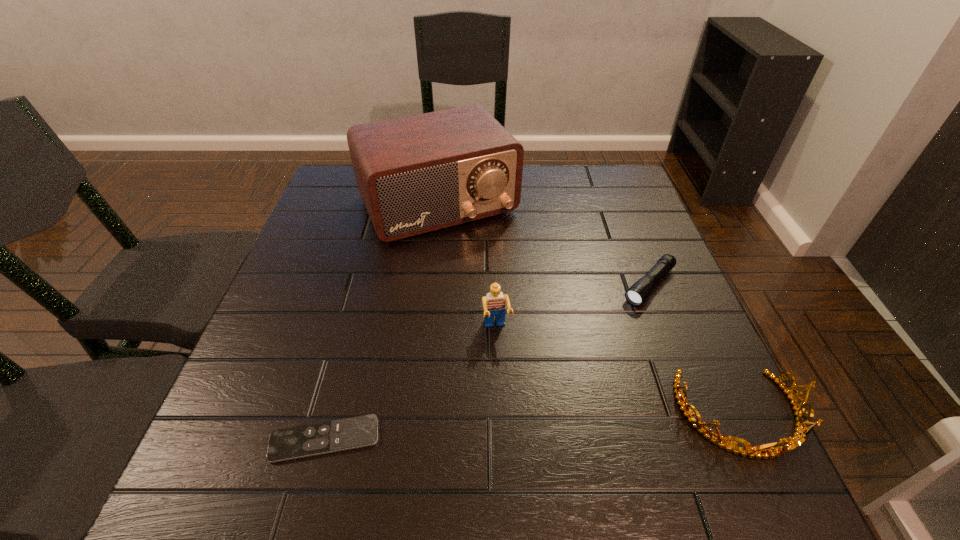
This screenshot has width=960, height=540. What are the coordinates of `the shortest object` in the screenshot? It's located at (285, 444).

This screenshot has height=540, width=960. In order to click on tiara in this screenshot , I will do `click(799, 437)`.

Identify the location of flashlight. (641, 289).

The height and width of the screenshot is (540, 960). What are the coordinates of `the fourth nearest object` in the screenshot? It's located at (641, 289).

What are the coordinates of `the tallest object` in the screenshot? It's located at (416, 174).

Locate an element on the screen. The height and width of the screenshot is (540, 960). the farthest object is located at coordinates (416, 174).

I want to click on the third nearest object, so click(493, 303).

This screenshot has width=960, height=540. In order to click on the fourth shortest object in this screenshot , I will do `click(493, 303)`.

Identify the location of free space located 0.320m on the back of the remote control. This screenshot has height=540, width=960. (365, 288).

Where is `vacant space located at the lens end of the fourth nearest object`? This screenshot has width=960, height=540. vacant space located at the lens end of the fourth nearest object is located at coordinates (589, 351).